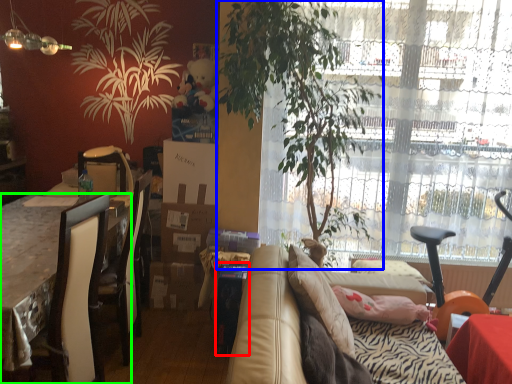
Question: Which object is positioned closest to box (highlighted by a red box)? Select from houseplant (highlighted by a blue box) and desk (highlighted by a green box).

Choices:
 (A) houseplant
 (B) desk

Answer: (A)